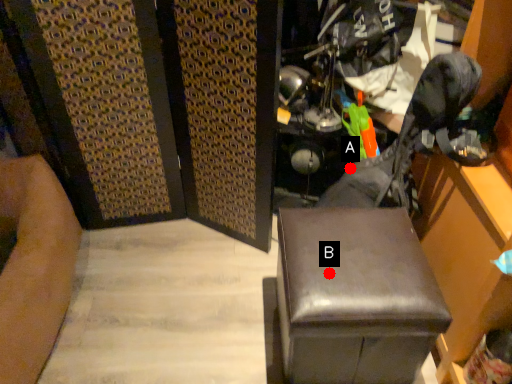
Question: Two points are circled on the image, labeled by A and B beside each circle. Which point is closer to the camera?

Choices:
 (A) A is closer
 (B) B is closer

Answer: (B)